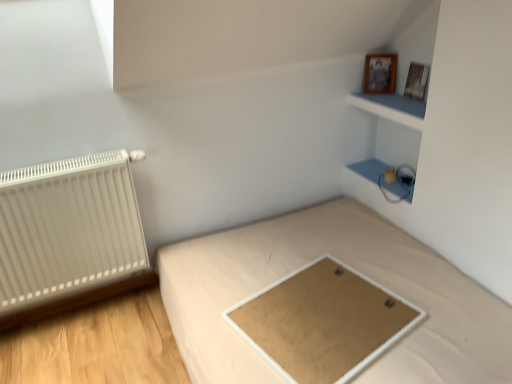
At what (x,y) coordinates should I click in order to perform the action: click on vacant space underneath matte brown board at center (from a real-world perspective). Please return your answer as a coordinate pair (x, y). The height and width of the screenshot is (384, 512). Looking at the image, I should click on (326, 317).